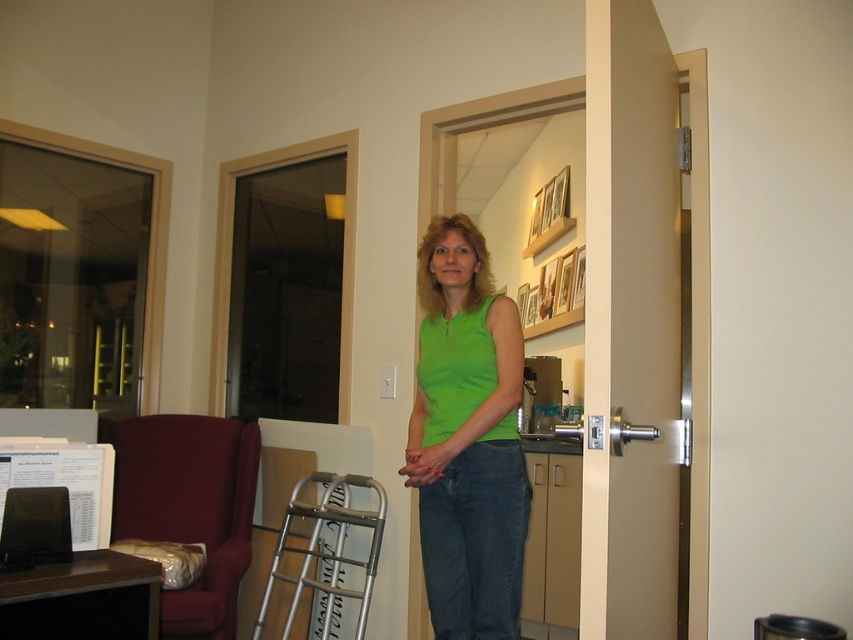
Which is in front, point (432, 237) or point (357, 477)?

Positioned in front is point (432, 237).

Can you confirm if green matte tank top at center is wider than silver metallic walker at lower center?

No, green matte tank top at center is not wider than silver metallic walker at lower center.

Who is more distant from viewer, (508, 339) or (260, 609)?

Positioned behind is point (260, 609).

Where is `green matte tank top at center`? green matte tank top at center is located at coordinates (467, 438).

Can you confirm if green matte tank top at center is positioned above velvet red armchair at left?

Yes, green matte tank top at center is above velvet red armchair at left.

Which is in front, point (438, 532) or point (151, 460)?

Point (438, 532) is more forward.

Locate an element on the screen. This screenshot has height=640, width=853. green matte tank top at center is located at coordinates (467, 438).

Between velvet red armchair at left and silver metallic walker at lower center, which one is positioned higher?

velvet red armchair at left

Which is more to the left, velvet red armchair at left or silver metallic walker at lower center?

velvet red armchair at left

Is point (239, 422) behind point (358, 483)?

Yes, point (239, 422) is behind point (358, 483).

The width and height of the screenshot is (853, 640). I want to click on velvet red armchair at left, so click(x=189, y=506).